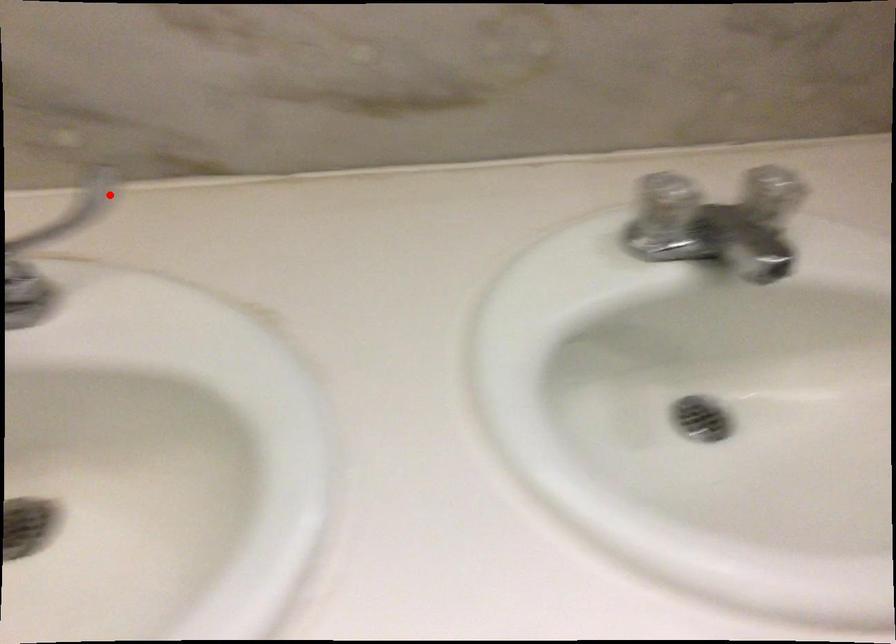
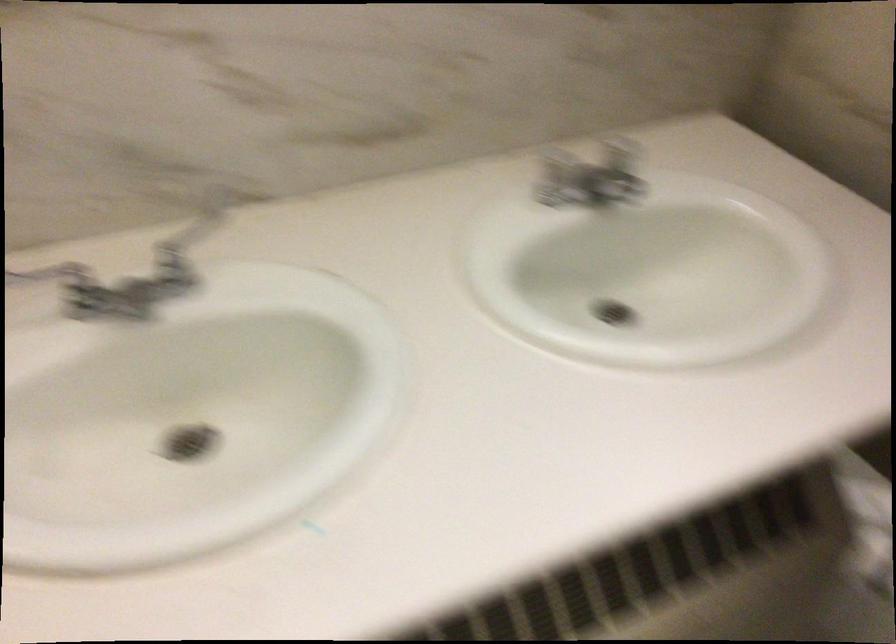
In the second image, find the point that corresponds to the highlighted location in the first image.

(196, 225)